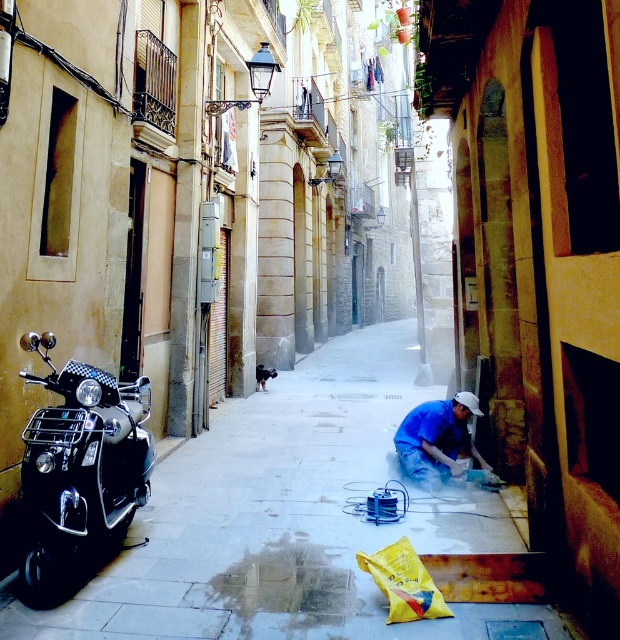
Does shiny black scooter at left appear on the left side of blue fabric at lower right?

Yes, shiny black scooter at left is to the left of blue fabric at lower right.

Measure the distance between point (46, 592) and camera.

Point (46, 592) and camera are 12.00 feet apart.

Between point (143, 481) and point (436, 456), which one is positioned behind?

The point (436, 456) is more distant.

Locate an element on the screen. This screenshot has width=620, height=640. shiny black scooter at left is located at coordinates (79, 468).

Between point (283, 557) and point (118, 488), which one is positioned in front?

Point (118, 488) is in front.

Who is positioned more to the right, smooth concrete pavement at center or shiny black scooter at left?

From the viewer's perspective, smooth concrete pavement at center appears more on the right side.

Does point (219, 429) lie behind point (33, 588)?

Yes.

You are a GUI agent. You are given a task and a screenshot of the screen. Output one action in this format:
    pyautogui.click(x=<x>, y=<y>)
    Task: Click on the smooth concrete pavement at center
    The width and height of the screenshot is (620, 640).
    Given the screenshot: What is the action you would take?
    pyautogui.click(x=290, y=518)

Between smooth concrete pavement at center and blue fabric at lower right, which one is positioned higher?

blue fabric at lower right is above.

Which of these two, smooth concrete pavement at center or blue fabric at lower right, stands taller?

blue fabric at lower right is taller.

Who is more forward, (341, 525) or (422, 461)?

Point (341, 525) is in front.

The image size is (620, 640). Find the location of `smooth concrete pavement at center`. smooth concrete pavement at center is located at coordinates (290, 518).